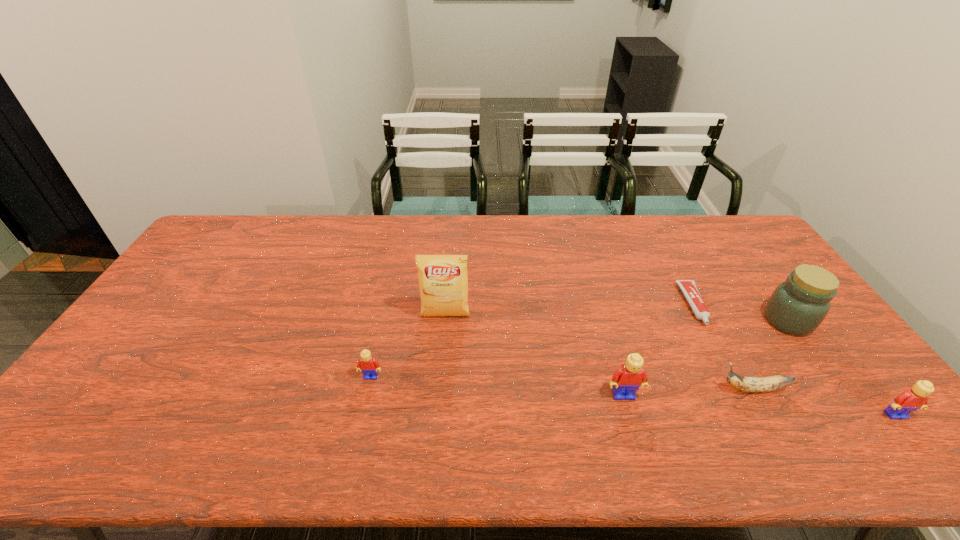
Where is `free space between the shortest object and the sixth object from right to left`? The image size is (960, 540). free space between the shortest object and the sixth object from right to left is located at coordinates (569, 310).

Locate an element on the screen. This screenshot has height=540, width=960. vacant area that lies between the banana and the leftmost Lego is located at coordinates (562, 383).

Locate an element on the screen. This screenshot has width=960, height=540. free spot between the banana and the shortest object is located at coordinates pyautogui.click(x=723, y=347).

The width and height of the screenshot is (960, 540). I want to click on free space between the tallest object and the toothpaste, so click(569, 310).

Identify the location of free space between the second nearest Lego and the toothpaste. Image resolution: width=960 pixels, height=540 pixels. (659, 350).

Locate an element on the screen. vacant area between the jar and the leftmost Lego is located at coordinates (580, 348).

The height and width of the screenshot is (540, 960). I want to click on object that ranks as the sixth closest to the banana, so click(369, 366).

This screenshot has width=960, height=540. In order to click on the second closest object to the banana in this screenshot , I will do `click(910, 400)`.

Identify which Lego is located as the third nearest to the banana. Please provide its 2D coordinates. Your answer should be formatted as a tuple, i.e. [(x, y)], where the tuple contains the x and y coordinates of a point satisfying the conditions above.

[(369, 366)]

Identify which Lego is located as the second nearest to the shortest Lego. Please provide its 2D coordinates. Your answer should be formatted as a tuple, i.e. [(x, y)], where the tuple contains the x and y coordinates of a point satisfying the conditions above.

[(910, 400)]